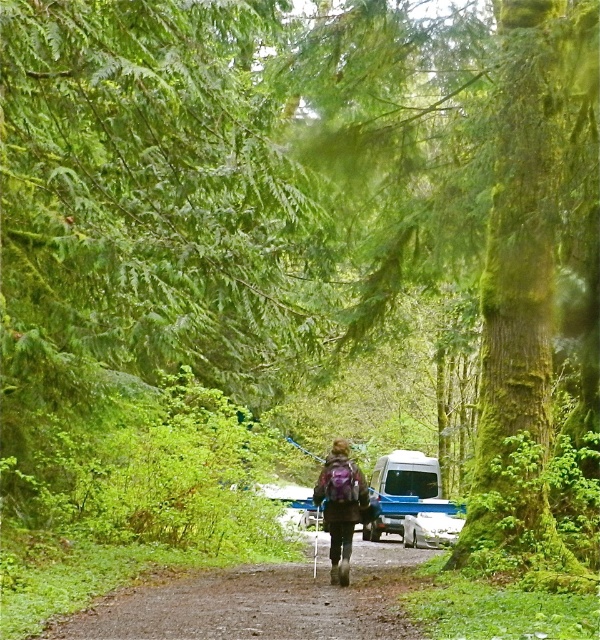
Question: Which point is farther to the camera?

Choices:
 (A) purple fabric backpack at center
 (B) white matte camper van at center

Answer: (B)

Question: Which of the following is the closest to the observer?

Choices:
 (A) (337, 557)
 (B) (409, 520)

Answer: (A)

Question: Does white matte camper van at center lie in front of purple fabric backpack at center?

Choices:
 (A) no
 (B) yes

Answer: (A)

Question: Among these objects, which one is farthest from the camera?

Choices:
 (A) white matte camper van at center
 (B) purple fabric backpack at center

Answer: (A)

Question: Is white matte camper van at center closer to the viewer compared to purple fabric backpack at center?

Choices:
 (A) no
 (B) yes

Answer: (A)

Question: Does white matte camper van at center come behind purple fabric backpack at center?

Choices:
 (A) no
 (B) yes

Answer: (B)